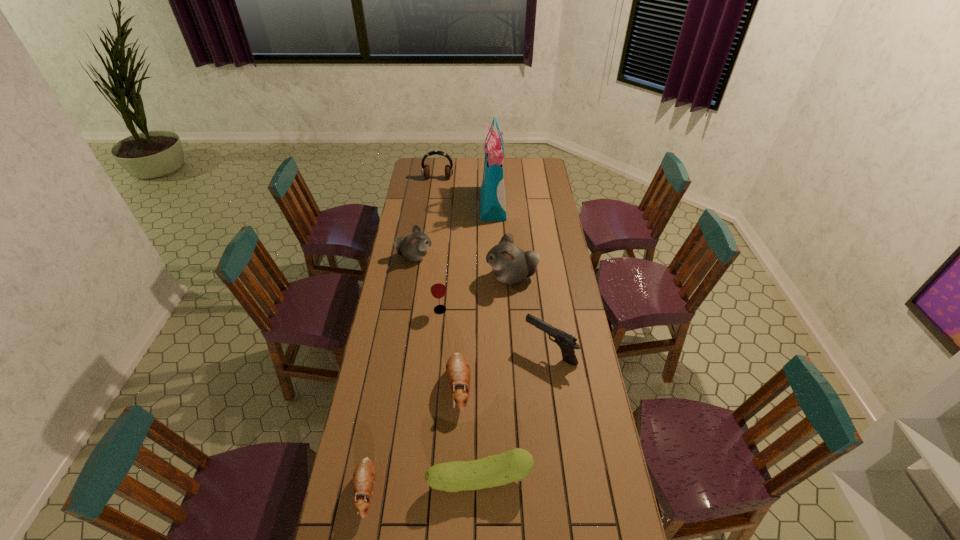
Where is `the eighth nearest object`? the eighth nearest object is located at coordinates (493, 208).

This screenshot has height=540, width=960. In order to click on the tallest object in this screenshot , I will do `click(493, 208)`.

At what (x,y) coordinates should I click in order to perform the action: click on the bigger white hamster. Please return your answer as a coordinate pair (x, y). The width and height of the screenshot is (960, 540). Looking at the image, I should click on (510, 264).

Locate an element on the screen. This screenshot has width=960, height=540. the right white hamster is located at coordinates (510, 264).

The width and height of the screenshot is (960, 540). Identify the location of the farthest object. (425, 171).

The width and height of the screenshot is (960, 540). What are the coordinates of `headset` in the screenshot? It's located at (425, 171).

This screenshot has height=540, width=960. Identify the location of glass. (438, 288).

What are the coordinates of `red glass` in the screenshot? It's located at (438, 288).

Where is `the third shortest hamster`? This screenshot has height=540, width=960. the third shortest hamster is located at coordinates (414, 247).

Identify the location of the smaller white hamster. The height and width of the screenshot is (540, 960). (414, 247).